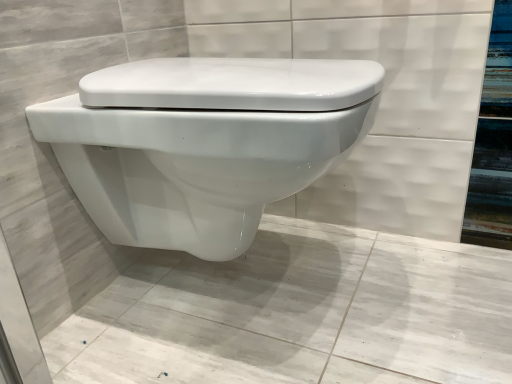
Question: From a real-world perspective, is white glossy toilet at center above or below white glossy toilet at center?

Choices:
 (A) above
 (B) below

Answer: (B)

Question: In the image, is white glossy toilet at center positioned in front of or behind white glossy toilet at center?

Choices:
 (A) front
 (B) behind

Answer: (A)

Question: In terms of height, does white glossy toilet at center look taller or shorter compared to white glossy toilet at center?

Choices:
 (A) short
 (B) tall

Answer: (A)

Question: Is point (258, 193) positioned closer to the camera than point (261, 312)?

Choices:
 (A) closer
 (B) farther

Answer: (A)

Question: Looking at the image, does white glossy toilet at center seem bigger or smaller compared to white glossy toilet at center?

Choices:
 (A) big
 (B) small

Answer: (A)

Question: Relative to white glossy toilet at center, is white glossy toilet at center in front or behind?

Choices:
 (A) behind
 (B) front

Answer: (A)

Question: Is white glossy toilet at center wider or thinner than white glossy toilet at center?

Choices:
 (A) thin
 (B) wide

Answer: (A)